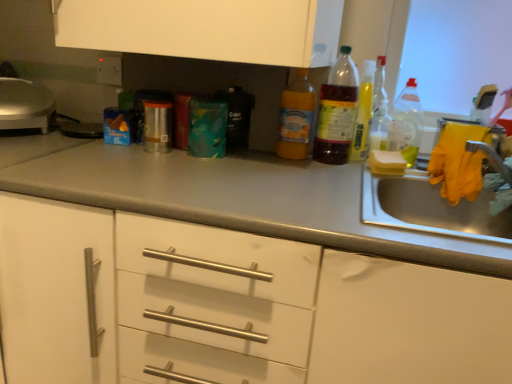
At what (x,y) coordinates should I click in order to perform the action: click on free point in front of translucent plastic bottle at center, the 5th bottle in the right-to-left sequence. Please return your answer as a coordinate pair (x, y). The image size is (512, 384). Looking at the image, I should click on (293, 167).